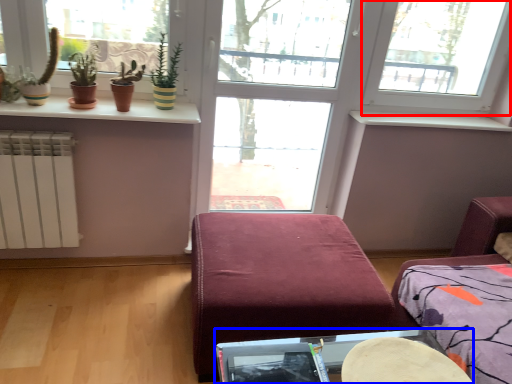
Question: Which point is closer to the camera, window (highlighted by a red box) or table (highlighted by a blue box)?

Choices:
 (A) window
 (B) table

Answer: (B)